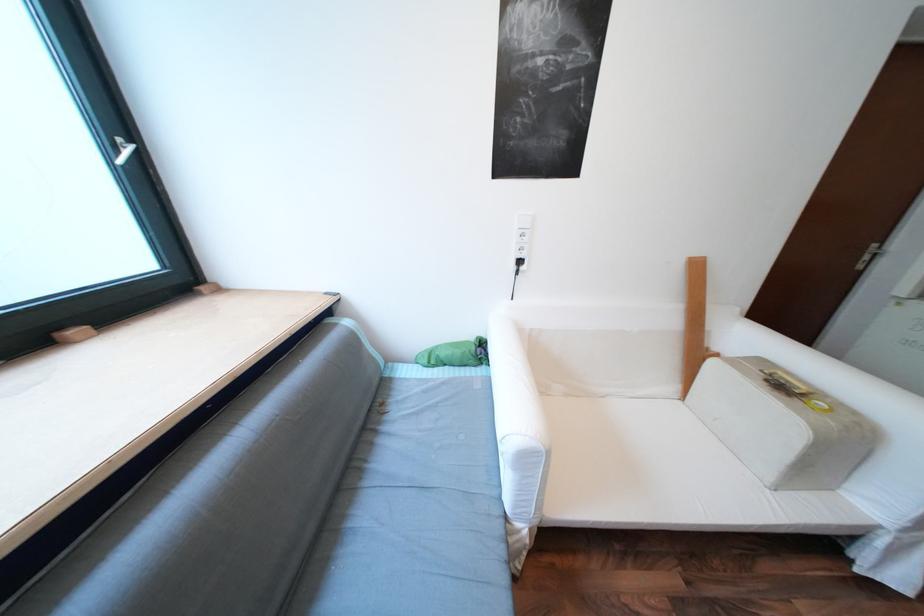
Find where to turn the white window handle. Please return your answer as a coordinate pair (x, y).

(123, 150)